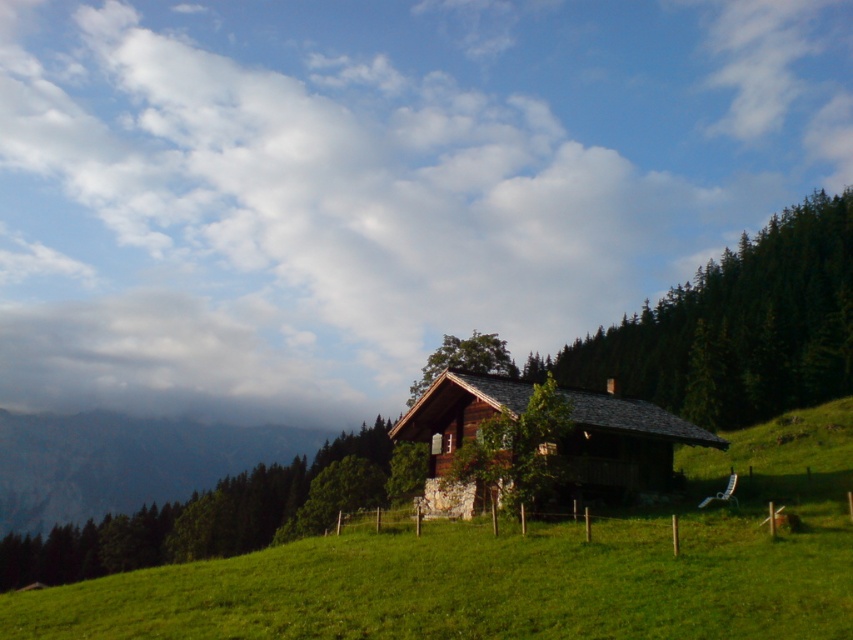
Question: Which object is farther from the camera taking this photo?

Choices:
 (A) wooden log cabin at center
 (B) white fluffy cloud at upper center
 (C) green grassy field at center

Answer: (B)

Question: Which point is farther to the camera?

Choices:
 (A) wooden log cabin at center
 (B) white fluffy cloud at upper center

Answer: (B)

Question: Does white fluffy cloud at upper center appear on the left side of green grassy field at center?

Choices:
 (A) yes
 (B) no

Answer: (A)

Question: Which object is positioned closest to the wooden log cabin at center?

Choices:
 (A) green grassy field at center
 (B) white fluffy cloud at upper center

Answer: (A)

Question: Does green grassy field at center have a smaller size compared to wooden log cabin at center?

Choices:
 (A) no
 (B) yes

Answer: (A)

Question: Is green grassy field at center wider than wooden log cabin at center?

Choices:
 (A) no
 (B) yes

Answer: (B)